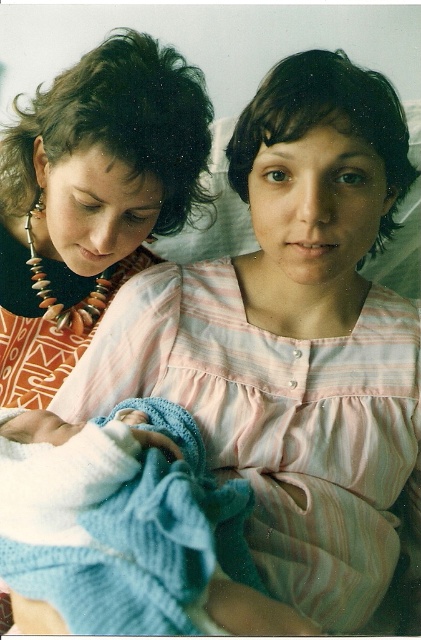
You are a photographer taking a family portrait. You notice the matte black necklace at upper left and the knitted blue blanket at center. Which object should you focus on if you want to capture the larger item in your shot?

The matte black necklace at upper left is bigger than the knitted blue blanket at center, so you should focus on the matte black necklace at upper left to capture the larger item.

You are a photographer adjusting the camera focus. You need to ensure both the matte black necklace at upper left and the knitted blue blanket at center are in focus. Given their sizes, which object should you adjust the focus on first to account for its larger size?

The matte black necklace at upper left should be focused first since it is wider than the knitted blue blanket at center, requiring more precise focus adjustment.